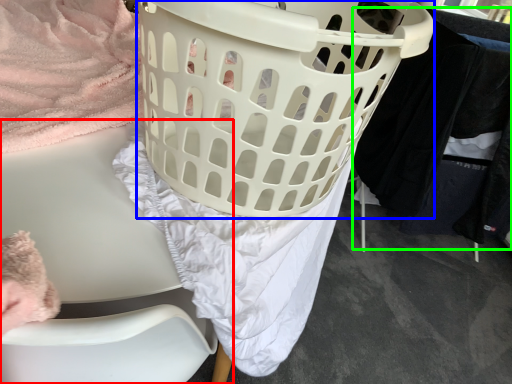
Question: Which object is the closest to the furniture (highlighted by a red box)? Choose among these: basket (highlighted by a blue box) or clothing (highlighted by a green box).

Choices:
 (A) basket
 (B) clothing

Answer: (A)